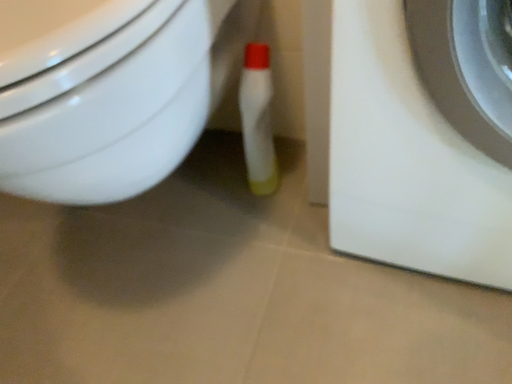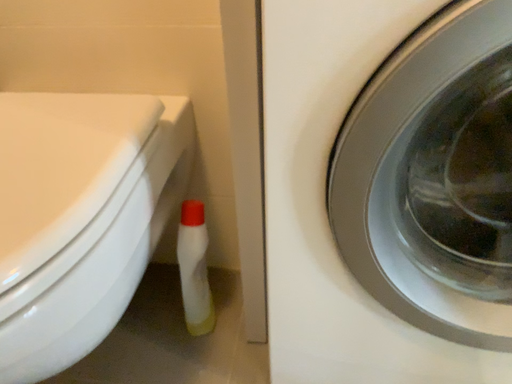
Question: How did the camera likely rotate when shooting the video?

Choices:
 (A) rotated upward
 (B) rotated downward

Answer: (A)